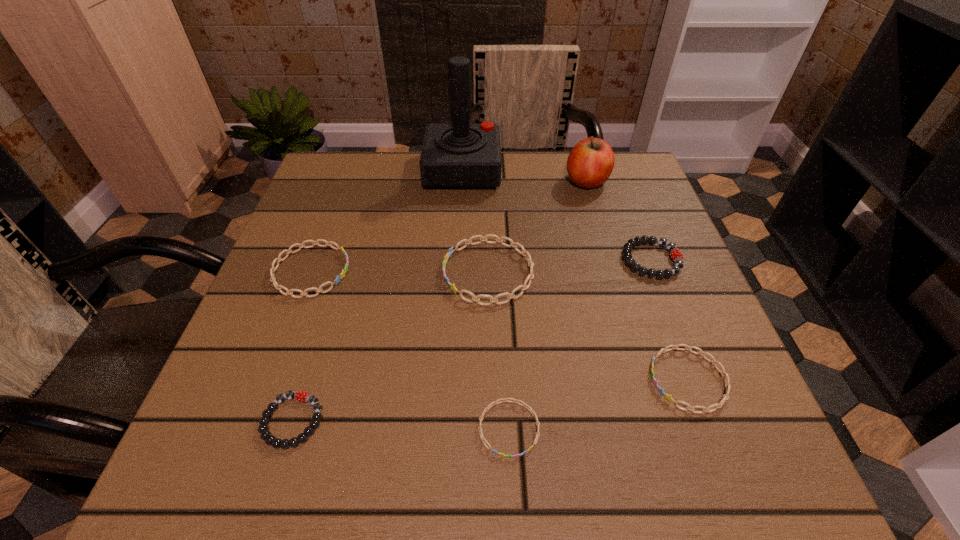
Identify the location of blank region between the joystick and the left black bracelet. Image resolution: width=960 pixels, height=540 pixels. (377, 296).

You are a GUI agent. You are given a task and a screenshot of the screen. Output one action in this format:
    pyautogui.click(x=<x>, y=<y>)
    Task: Click on the free space that is in between the nearer black bracelet and the biggest blue bracelet
    This screenshot has height=540, width=960.
    Given the screenshot: What is the action you would take?
    pyautogui.click(x=391, y=347)

The image size is (960, 540). I want to click on empty location between the tallest object and the third smallest blue bracelet, so click(387, 221).

Locate an element on the screen. The height and width of the screenshot is (540, 960). free space between the leftmost blue bracelet and the farther black bracelet is located at coordinates pos(481,266).

Locate an element on the screen. blank region between the bigger black bracelet and the third biggest blue bracelet is located at coordinates (670, 320).

Point out which object is positioned as the fourth nearest to the third tallest object. Please provide its 2D coordinates. Your answer should be formatted as a tuple, i.e. [(x, y)], where the tuple contains the x and y coordinates of a point satisfying the conditions above.

[(492, 404)]

Find the location of a particular element. object that is the closest one to the smallest blue bracelet is located at coordinates (727, 384).

Find the location of a particular element. the sixth closest bracelet to the red joystick is located at coordinates (492, 404).

Select which bracelet appears as the third closest to the joystick. Please provide its 2D coordinates. Your answer should be formatted as a tuple, i.e. [(x, y)], where the tuple contains the x and y coordinates of a point satisfying the conditions above.

[(676, 255)]

Locate which blue bracelet is the closest to the second biggest blue bracelet. Please provide its 2D coordinates. Your answer should be formatted as a tuple, i.e. [(x, y)], where the tuple contains the x and y coordinates of a point satisfying the conditions above.

[(523, 287)]